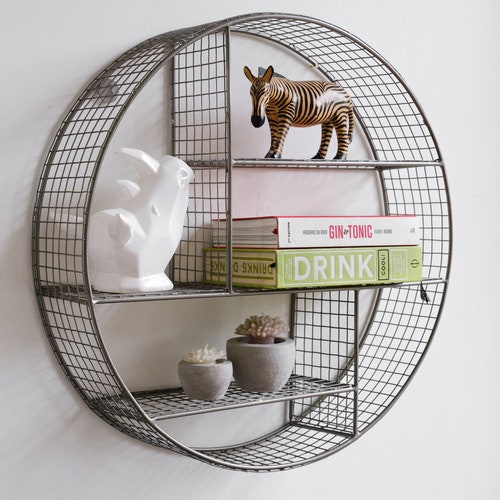
Locate an element on the screen. The height and width of the screenshot is (500, 500). larger flower pot is located at coordinates [275, 372].